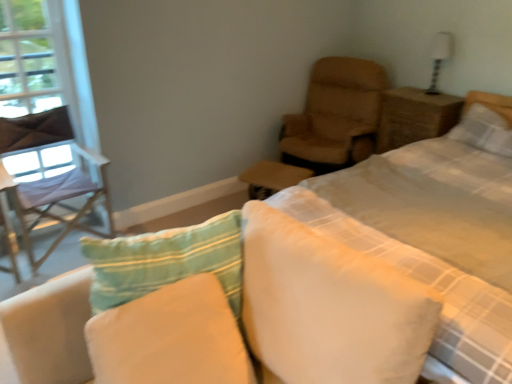
Locate an element on the screen. The width and height of the screenshot is (512, 384). leather-like tan chair at upper right, the second chair in the left-to-right sequence is located at coordinates (335, 116).

What is the approximate width of transparent plastic window screen at left?

transparent plastic window screen at left is 3.13 inches in width.

In order to face white textured pillow at upper right, which is the 1th pillow from top to bottom, should I rotate leftwards or rightwards?

You should look right and rotate roughly 28.475 degrees.

This screenshot has height=384, width=512. What are the coordinates of `soft cotton pillow at center, arranged as the first pillow when ordered from the bottom` in the screenshot? It's located at (170, 338).

The width and height of the screenshot is (512, 384). What do you see at coordinates (329, 306) in the screenshot?
I see `white soft pillow at center, positioned as the 2th pillow in front-to-back order` at bounding box center [329, 306].

The width and height of the screenshot is (512, 384). In order to click on white checkered quilt at upper right in this screenshot , I will do `click(444, 239)`.

This screenshot has width=512, height=384. In order to click on brown wicker nightstand at upper right in this screenshot , I will do `click(414, 117)`.

Where is `quilt below the brown wicker nightstand at upper right (from a real-world perspective)`? quilt below the brown wicker nightstand at upper right (from a real-world perspective) is located at coordinates (444, 239).

How many degrees apart are the facing directions of white checkered quilt at upper right and brown wicker nightstand at upper right?

1.45 degrees separate the facing orientations of white checkered quilt at upper right and brown wicker nightstand at upper right.

Is white checkered quilt at upper right aimed at brown wicker nightstand at upper right?

No, white checkered quilt at upper right does not turn towards brown wicker nightstand at upper right.

From a real-world perspective, between white checkered quilt at upper right and brown wicker nightstand at upper right, who is vertically lower?

white checkered quilt at upper right is physically lower.

Based on the photo, is transparent plastic window screen at left smaller than soft cotton pillow at center, the first pillow positioned from the left?

Yes, transparent plastic window screen at left is smaller than soft cotton pillow at center, the first pillow positioned from the left.

Is transparent plastic window screen at left oriented towards soft cotton pillow at center, marked as the third pillow in a back-to-front arrangement?

Yes, transparent plastic window screen at left is oriented towards soft cotton pillow at center, marked as the third pillow in a back-to-front arrangement.

Considering the relative sizes of transparent plastic window screen at left and soft cotton pillow at center, which ranks as the first pillow in front-to-back order, in the image provided, is transparent plastic window screen at left thinner than soft cotton pillow at center, which ranks as the first pillow in front-to-back order,?

Correct, the width of transparent plastic window screen at left is less than that of soft cotton pillow at center, which ranks as the first pillow in front-to-back order.

From the image's perspective, is light purple fabric chair at left, which is the 2th chair from right to left, above or below white checkered quilt at upper right?

Based on their image positions, light purple fabric chair at left, which is the 2th chair from right to left, is located above white checkered quilt at upper right.

In the scene shown: Is light purple fabric chair at left, which is the 2th chair from right to left, outside of white checkered quilt at upper right?

light purple fabric chair at left, which is the 2th chair from right to left, lies outside white checkered quilt at upper right's area.

Is light purple fabric chair at left, acting as the 1th chair starting from the left, bigger or smaller than white checkered quilt at upper right?

In the image, light purple fabric chair at left, acting as the 1th chair starting from the left, appears to be smaller than white checkered quilt at upper right.

At what (x,y) coordinates should I click in order to perform the action: click on nightstand that appears below the transparent plastic window screen at left (from the image's perspective). Please return your answer as a coordinate pair (x, y). Looking at the image, I should click on (414, 117).

Is transparent plastic window screen at left facing away from brown wicker nightstand at upper right?

That's not correct — transparent plastic window screen at left is not looking away from brown wicker nightstand at upper right.

Considering the relative sizes of transparent plastic window screen at left and brown wicker nightstand at upper right in the image provided, is transparent plastic window screen at left taller than brown wicker nightstand at upper right?

Correct, transparent plastic window screen at left is much taller as brown wicker nightstand at upper right.

Considering the sizes of objects light purple fabric chair at left, which is the 2th chair from right to left, and brown wicker nightstand at upper right in the image provided, who is wider, light purple fabric chair at left, which is the 2th chair from right to left, or brown wicker nightstand at upper right?

With larger width is light purple fabric chair at left, which is the 2th chair from right to left.

From a real-world perspective, which is physically above, light purple fabric chair at left, which is the 2th chair from right to left, or brown wicker nightstand at upper right?

brown wicker nightstand at upper right.

Is light purple fabric chair at left, acting as the 1th chair starting from the left, turned away from brown wicker nightstand at upper right?

No, light purple fabric chair at left, acting as the 1th chair starting from the left, is not facing the opposite direction of brown wicker nightstand at upper right.

Considering the sizes of objects light purple fabric chair at left, which is the 2th chair from right to left, and brown wicker nightstand at upper right in the image provided, who is bigger, light purple fabric chair at left, which is the 2th chair from right to left, or brown wicker nightstand at upper right?

Bigger between the two is light purple fabric chair at left, which is the 2th chair from right to left.

In the scene shown: From a real-world perspective, is white textured pillow at upper right, the 1th pillow in the back-to-front sequence, above or below leather-like tan chair at upper right, the second chair in the left-to-right sequence?

white textured pillow at upper right, the 1th pillow in the back-to-front sequence, is above leather-like tan chair at upper right, the second chair in the left-to-right sequence.

Is white textured pillow at upper right, the 1th pillow in the back-to-front sequence, turned away from leather-like tan chair at upper right, the first chair in the right-to-left sequence?

No, white textured pillow at upper right, the 1th pillow in the back-to-front sequence,'s orientation is not away from leather-like tan chair at upper right, the first chair in the right-to-left sequence.

Considering the sizes of white textured pillow at upper right, the first pillow when ordered from right to left, and leather-like tan chair at upper right, the second chair in the left-to-right sequence, in the image, is white textured pillow at upper right, the first pillow when ordered from right to left, taller or shorter than leather-like tan chair at upper right, the second chair in the left-to-right sequence,?

In the image, white textured pillow at upper right, the first pillow when ordered from right to left, appears to be shorter than leather-like tan chair at upper right, the second chair in the left-to-right sequence.

What's the angular difference between transparent plastic window screen at left and white textured pillow at upper right, the first pillow when ordered from right to left,'s facing directions?

The angle between the facing direction of transparent plastic window screen at left and the facing direction of white textured pillow at upper right, the first pillow when ordered from right to left, is 90.8 degrees.

Between transparent plastic window screen at left and white textured pillow at upper right, the 1th pillow in the back-to-front sequence, which one appears on the right side from the viewer's perspective?

white textured pillow at upper right, the 1th pillow in the back-to-front sequence.

Consider the image. Is transparent plastic window screen at left next to white textured pillow at upper right, the third pillow when ordered from bottom to top?

transparent plastic window screen at left and white textured pillow at upper right, the third pillow when ordered from bottom to top, are clearly separated.

From the image's perspective, is transparent plastic window screen at left under white textured pillow at upper right, the 1th pillow in the back-to-front sequence?

Incorrect, from the image's perspective, transparent plastic window screen at left is higher than white textured pillow at upper right, the 1th pillow in the back-to-front sequence.

You are a GUI agent. You are given a task and a screenshot of the screen. Output one action in this format:
    pyautogui.click(x=<x>, y=<y>)
    Task: Click on the nightstand above the white checkered quilt at upper right (from the image's perspective)
    This screenshot has height=384, width=512.
    Given the screenshot: What is the action you would take?
    pyautogui.click(x=414, y=117)

This screenshot has width=512, height=384. What are the coordinates of `window screen behind the soft cotton pillow at center, which is the 3th pillow from right to left` in the screenshot? It's located at (34, 60).

Which object lies further to the anchor point white checkered quilt at upper right, leather-like tan chair at upper right, the first chair in the right-to-left sequence, or white textured pillow at upper right, placed as the 3th pillow when sorted from front to back?

The object further to white checkered quilt at upper right is leather-like tan chair at upper right, the first chair in the right-to-left sequence.

Looking at the image, which one is located further to brown leather ottoman at center, white textured pillow at upper right, which is the 1th pillow from top to bottom, or white checkered quilt at upper right?

The object further to brown leather ottoman at center is white textured pillow at upper right, which is the 1th pillow from top to bottom.

Which object lies nearer to the anchor point transparent plastic window screen at left, white glossy table lamp at upper right or soft cotton pillow at center, which ranks as the first pillow in front-to-back order?

soft cotton pillow at center, which ranks as the first pillow in front-to-back order, is positioned closer to the anchor transparent plastic window screen at left.

Considering their positions, is white soft pillow at center, which appears as the second pillow when viewed from the left, positioned closer to white glossy table lamp at upper right than transparent plastic window screen at left?

Among the two, white soft pillow at center, which appears as the second pillow when viewed from the left, is located nearer to white glossy table lamp at upper right.

Considering their positions, is brown wicker nightstand at upper right positioned closer to white soft pillow at center, positioned as the 2th pillow in front-to-back order, than white checkered quilt at upper right?

white checkered quilt at upper right lies closer to white soft pillow at center, positioned as the 2th pillow in front-to-back order, than the other object.

Based on the photo, looking at the image, which one is located further to soft cotton pillow at center, which is the 3th pillow from right to left, leather-like tan chair at upper right, the first chair in the right-to-left sequence, or brown leather ottoman at center?

Based on the image, leather-like tan chair at upper right, the first chair in the right-to-left sequence, appears to be further to soft cotton pillow at center, which is the 3th pillow from right to left.

Estimate the real-world distances between objects in this image. Which object is further from light purple fabric chair at left, acting as the 1th chair starting from the left, transparent plastic window screen at left or brown wicker nightstand at upper right?

Among the two, brown wicker nightstand at upper right is located further to light purple fabric chair at left, acting as the 1th chair starting from the left.

Based on their spatial positions, is leather-like tan chair at upper right, the first chair in the right-to-left sequence, or soft cotton pillow at center, the first pillow positioned from the left, closer to white checkered quilt at upper right?

Based on the image, leather-like tan chair at upper right, the first chair in the right-to-left sequence, appears to be nearer to white checkered quilt at upper right.

At what (x,y) coordinates should I click in order to perform the action: click on chair between transparent plastic window screen at left and leather-like tan chair at upper right, the first chair in the right-to-left sequence, from left to right. Please return your answer as a coordinate pair (x, y). Looking at the image, I should click on (61, 200).

The image size is (512, 384). What are the coordinates of `quilt between transparent plastic window screen at left and white glossy table lamp at upper right` in the screenshot? It's located at (444, 239).

The height and width of the screenshot is (384, 512). What are the coordinates of `table between light purple fabric chair at left, which is the 2th chair from right to left, and white checkered quilt at upper right` in the screenshot? It's located at (272, 178).

You are a GUI agent. You are given a task and a screenshot of the screen. Output one action in this format:
    pyautogui.click(x=<x>, y=<y>)
    Task: Click on the nightstand between light purple fabric chair at left, which is the 2th chair from right to left, and white glossy table lamp at upper right
    This screenshot has height=384, width=512.
    Given the screenshot: What is the action you would take?
    pyautogui.click(x=414, y=117)